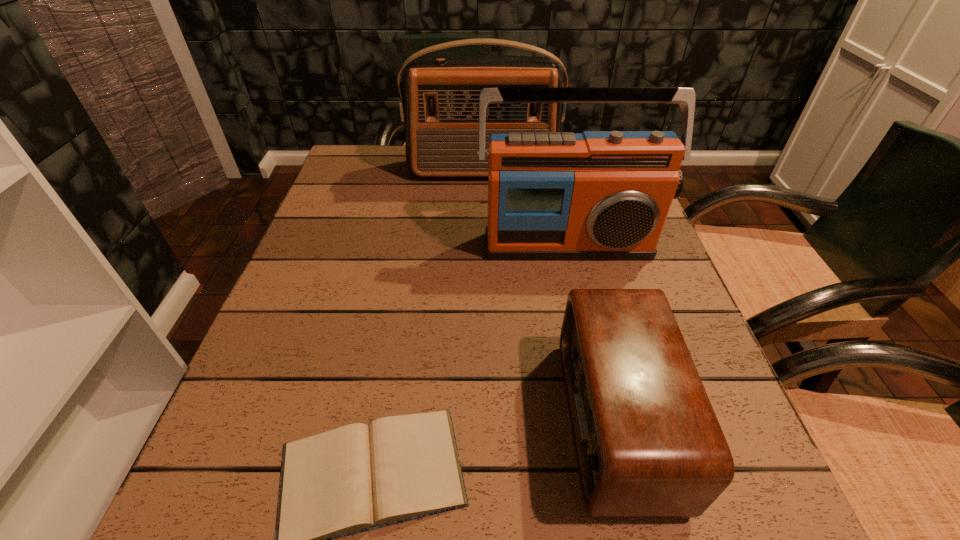
You are a GUI agent. You are given a task and a screenshot of the screen. Output one action in this format:
    pyautogui.click(x=<x>, y=<y>)
    Task: Click on the second farthest object
    This screenshot has height=540, width=960.
    Given the screenshot: What is the action you would take?
    pyautogui.click(x=598, y=195)

This screenshot has height=540, width=960. In order to click on the farthest object in this screenshot , I will do `click(440, 107)`.

Locate an element on the screen. The width and height of the screenshot is (960, 540). the nearest radio receiver is located at coordinates (648, 444).

Locate an element on the screen. The width and height of the screenshot is (960, 540). the third tallest object is located at coordinates (648, 444).

At what (x,y) coordinates should I click in order to perform the action: click on free space located on the front-facing side of the third nearest object. Please return your answer as a coordinate pair (x, y). Looking at the image, I should click on (595, 370).

Find the location of a particular element. free location located 0.090m on the front-facing side of the farthest radio receiver is located at coordinates (483, 203).

The height and width of the screenshot is (540, 960). Find the location of `vacant space located 0.200m on the front panel of the nearest radio receiver`. vacant space located 0.200m on the front panel of the nearest radio receiver is located at coordinates (438, 420).

At what (x,y) coordinates should I click in order to perform the action: click on free space located on the front panel of the nearest radio receiver. Please return your answer as a coordinate pair (x, y). Looking at the image, I should click on (444, 420).

Find the location of a particular element. vacant space situated 0.100m on the front panel of the nearest radio receiver is located at coordinates (504, 420).

The image size is (960, 540). Find the location of `object positioned at the far edge`. object positioned at the far edge is located at coordinates (440, 107).